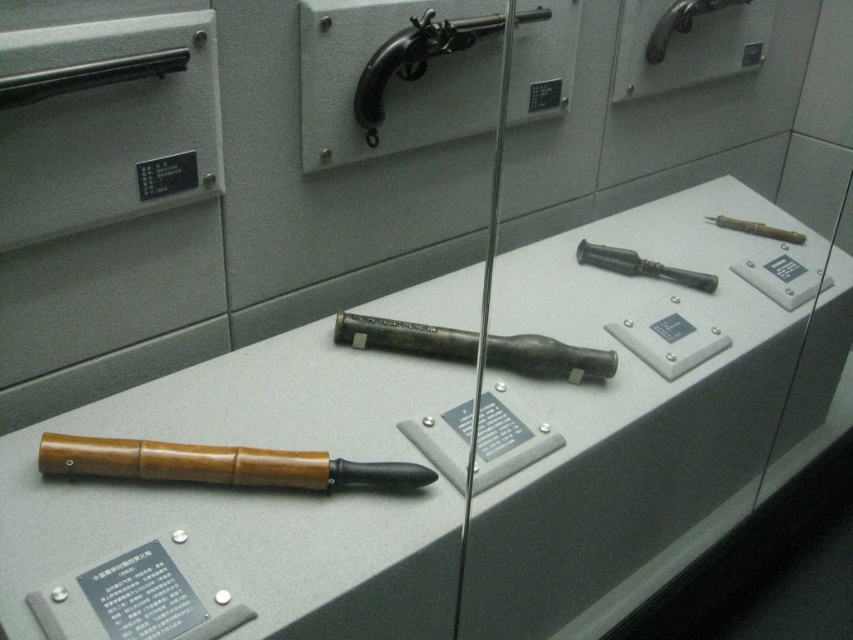
Is point (408, 72) farther from viewer compared to point (689, 276)?

No.

Consider the image. Is polished metal pistol at upper center positioned in front of matte silver pipe at upper center?

Yes.

Is point (469, 22) positioned before point (666, 275)?

Yes, point (469, 22) is in front of point (666, 275).

Locate an element on the screen. polished metal pistol at upper center is located at coordinates (413, 60).

Can you confirm if wooden handle knife at lower left is positioned to the left of polished metal pistol at upper center?

Correct, you'll find wooden handle knife at lower left to the left of polished metal pistol at upper center.

Is point (276, 458) positioned behind point (352, 100)?

No.

At what (x,y) coordinates should I click in order to perform the action: click on wooden handle knife at lower left. Please return your answer as a coordinate pair (x, y). This screenshot has width=853, height=640. Looking at the image, I should click on (219, 465).

You are a GUI agent. You are given a task and a screenshot of the screen. Output one action in this format:
    pyautogui.click(x=<x>, y=<y>)
    Task: Click on the wooden handle knife at lower left
    
    Given the screenshot: What is the action you would take?
    pyautogui.click(x=219, y=465)

I want to click on matte gray display case at center, so click(x=645, y=408).

Is matte gray display case at center above matte silver pipe at upper center?

No.

The image size is (853, 640). Describe the element at coordinates (645, 408) in the screenshot. I see `matte gray display case at center` at that location.

The image size is (853, 640). I want to click on matte gray display case at center, so click(x=645, y=408).